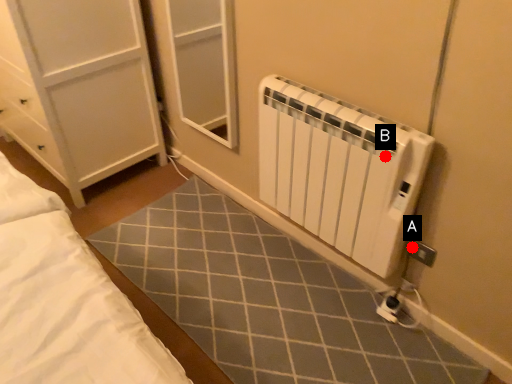
Question: Two points are circled on the image, labeled by A and B beside each circle. Which point appears farthest from the camera in this image?

Choices:
 (A) A is further
 (B) B is further

Answer: (A)